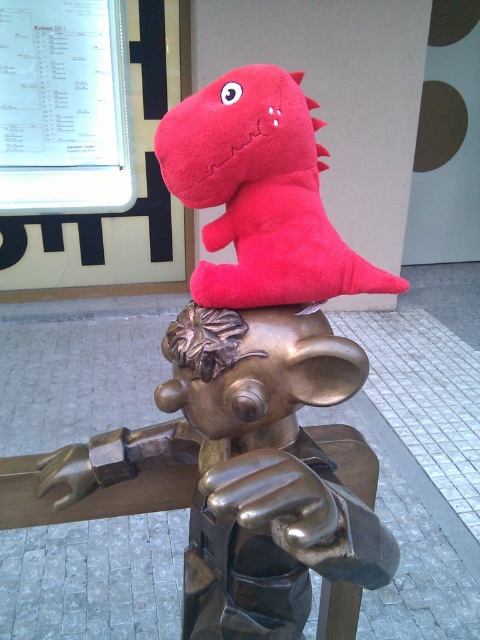
Question: Is bronze statue at center bigger than metallic gold head at center?

Choices:
 (A) no
 (B) yes

Answer: (B)

Question: Can you confirm if bronze statue at center is positioned to the left of matte plush dinosaur at upper center?

Choices:
 (A) no
 (B) yes

Answer: (B)

Question: Which object appears closest to the camera in this image?

Choices:
 (A) metallic gold head at center
 (B) matte plush dinosaur at upper center
 (C) bronze statue at center

Answer: (C)

Question: Considering the real-world distances, which object is farthest from the bronze statue at center?

Choices:
 (A) matte plush dinosaur at upper center
 (B) metallic gold head at center

Answer: (A)

Question: Which point is farther to the camera?

Choices:
 (A) metallic gold head at center
 (B) matte plush dinosaur at upper center

Answer: (A)

Question: Is matte plush dinosaur at upper center further to camera compared to metallic gold head at center?

Choices:
 (A) yes
 (B) no

Answer: (B)